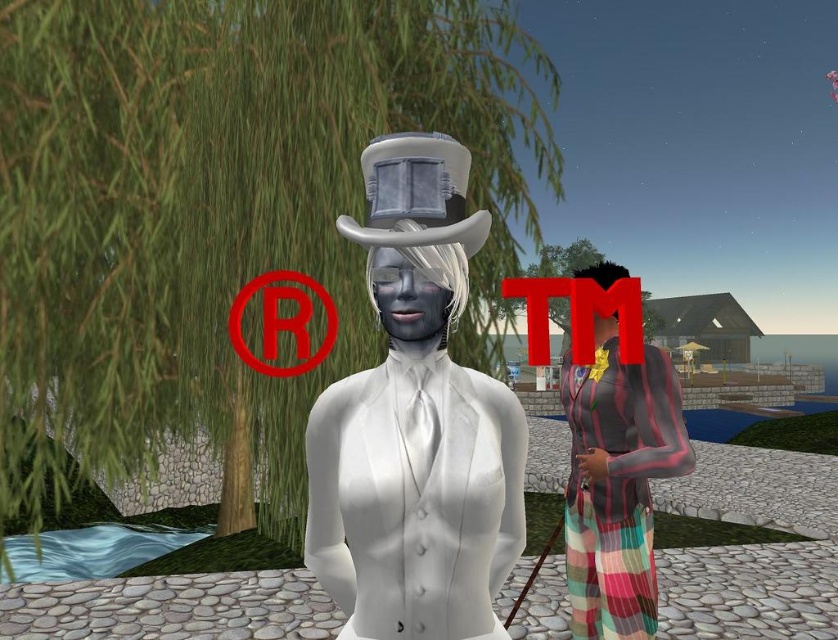
You are standing at point (422, 154) and want to walk to the cabin. Which direction should you go relative to point (463, 208)?

You should go towards point (463, 208) because it is in front of your current position at point (422, 154), so moving towards it would lead you closer to the cabin.

You are navigating a virtual environment and need to locate the white matte suit at center. According to the coordinates provided, where exactly would you find it?

The white matte suit at center is located at point coordinates of [415,422].

Consider the image. You are standing in the scene described. You need to locate the striped fabric dress at right. Where is it positioned in terms of its horizontal and vertical placement relative to the center of the image?

The striped fabric dress at right is positioned at 75.2 percent horizontally from the left edge and 73.7 percent vertically from the bottom edge of the image.